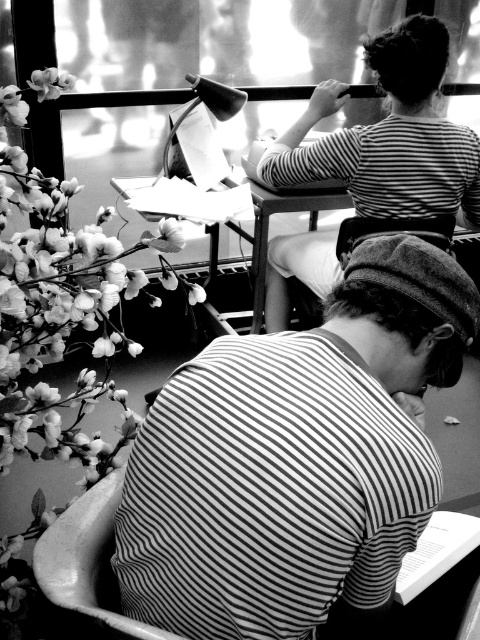
Can you confirm if smooth wooden table at center is positioned above soft white petals at upper left?

Actually, smooth wooden table at center is below soft white petals at upper left.

Is smooth wooden table at center wider than soft white petals at upper left?

Yes, smooth wooden table at center is wider than soft white petals at upper left.

Does point (257, 236) lie in front of point (44, 86)?

No.

Locate an element on the screen. Image resolution: width=480 pixels, height=640 pixels. smooth wooden table at center is located at coordinates (267, 228).

Between striped fabric shirt at lower center and soft white petals at upper left, which one is positioned higher?

soft white petals at upper left is higher up.

Between striped fabric shirt at lower center and soft white petals at upper left, which one appears on the right side from the viewer's perspective?

striped fabric shirt at lower center

Is point (179, 532) positioned in front of point (49, 81)?

That is True.

Where is `striped fabric shirt at lower center`? striped fabric shirt at lower center is located at coordinates (295, 458).

Which is below, fluffy white flowers at left or soft white petals at upper left?

fluffy white flowers at left is below.

Between fluffy white flowers at left and soft white petals at upper left, which one appears on the right side from the viewer's perspective?

soft white petals at upper left is more to the right.

Between point (66, 324) and point (54, 81), which one is positioned in front?

Point (54, 81) is more forward.

Locate an element on the screen. The height and width of the screenshot is (640, 480). fluffy white flowers at left is located at coordinates (63, 307).